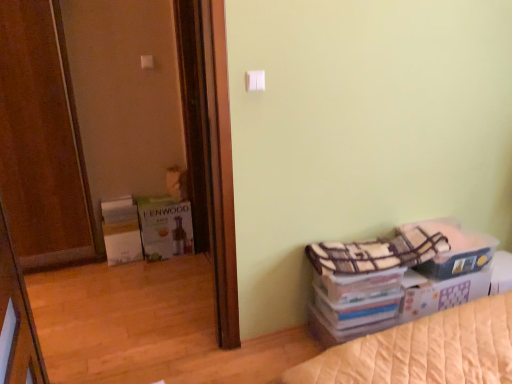
Question: Does plaid fabric storage box at lower right have a larger size compared to white plastic light switch at upper center, which ranks as the 2th light switch in bottom-to-top order?

Choices:
 (A) yes
 (B) no

Answer: (A)

Question: Is plaid fabric storage box at lower right in contact with white plastic light switch at upper center, which appears as the first light switch when viewed from the left?

Choices:
 (A) no
 (B) yes

Answer: (A)

Question: Does plaid fabric storage box at lower right have a greater height compared to white plastic light switch at upper center, which ranks as the 2th light switch in bottom-to-top order?

Choices:
 (A) no
 (B) yes

Answer: (B)

Question: From the image's perspective, is plaid fabric storage box at lower right under white plastic light switch at upper center, which is the first light switch in back-to-front order?

Choices:
 (A) yes
 (B) no

Answer: (A)

Question: Is the position of plaid fabric storage box at lower right less distant than that of white plastic light switch at upper center, which ranks as the 2th light switch in right-to-left order?

Choices:
 (A) no
 (B) yes

Answer: (B)

Question: Based on their sizes in the image, would you say white plastic light switch at upper center, which is the first light switch in back-to-front order, is bigger or smaller than plaid fabric storage box at lower right?

Choices:
 (A) big
 (B) small

Answer: (B)

Question: Is white plastic light switch at upper center, which ranks as the 2th light switch in bottom-to-top order, inside the boundaries of plaid fabric storage box at lower right, or outside?

Choices:
 (A) outside
 (B) inside

Answer: (A)

Question: From a real-world perspective, is white plastic light switch at upper center, which is the first light switch in back-to-front order, positioned above or below plaid fabric storage box at lower right?

Choices:
 (A) above
 (B) below

Answer: (A)

Question: From the image's perspective, relative to plaid fabric storage box at lower right, is white plastic light switch at upper center, which appears as the first light switch when viewed from the left, above or below?

Choices:
 (A) below
 (B) above

Answer: (B)

Question: Is wooden door at left bigger or smaller than white plastic light switch at upper center, which ranks as the 2th light switch in right-to-left order?

Choices:
 (A) big
 (B) small

Answer: (A)

Question: Do you think wooden door at left is within white plastic light switch at upper center, which is the 2th light switch in front-to-back order, or outside of it?

Choices:
 (A) inside
 (B) outside

Answer: (B)

Question: From the image's perspective, is wooden door at left positioned above or below white plastic light switch at upper center, which is the 2th light switch in front-to-back order?

Choices:
 (A) below
 (B) above

Answer: (A)

Question: In terms of width, does wooden door at left look wider or thinner when compared to white plastic light switch at upper center, the first light switch viewed from the top?

Choices:
 (A) thin
 (B) wide

Answer: (B)

Question: From the image's perspective, is white plastic light switch at upper center, positioned as the second light switch in top-to-bottom order, located above or below plaid fabric storage box at lower right?

Choices:
 (A) below
 (B) above

Answer: (B)

Question: From a real-world perspective, is white plastic light switch at upper center, positioned as the second light switch in top-to-bottom order, positioned above or below plaid fabric storage box at lower right?

Choices:
 (A) below
 (B) above

Answer: (B)